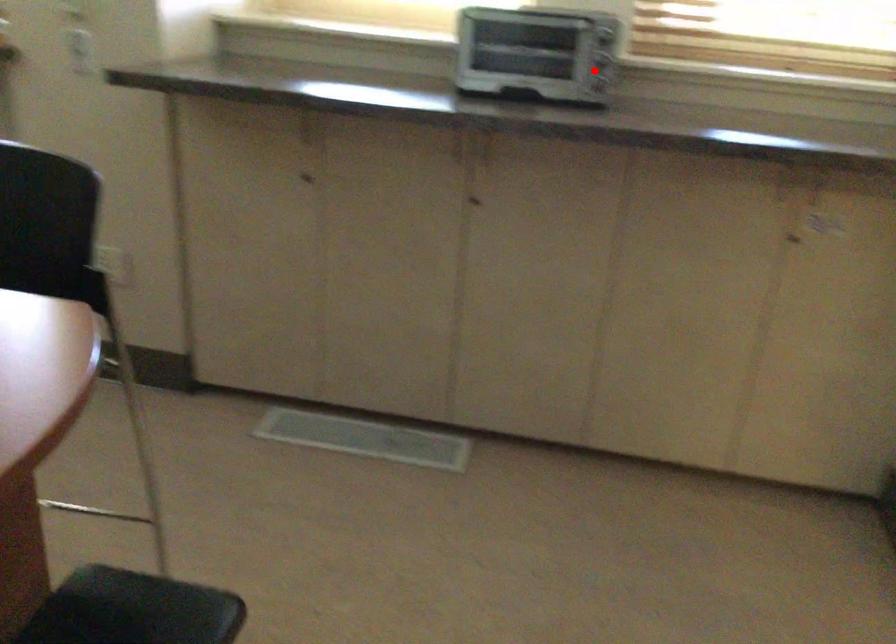
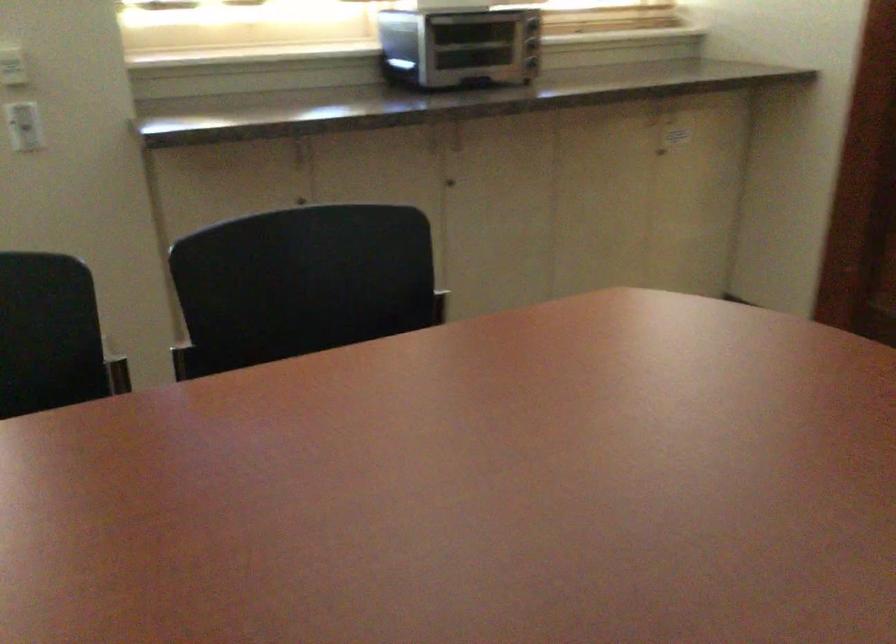
In the second image, find the point that corresponds to the highlighted location in the first image.

(531, 44)